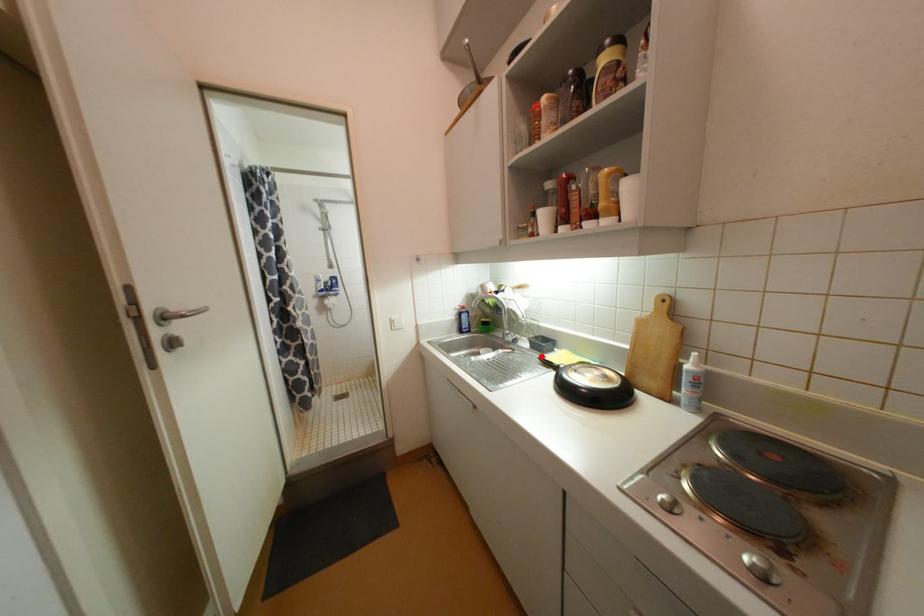
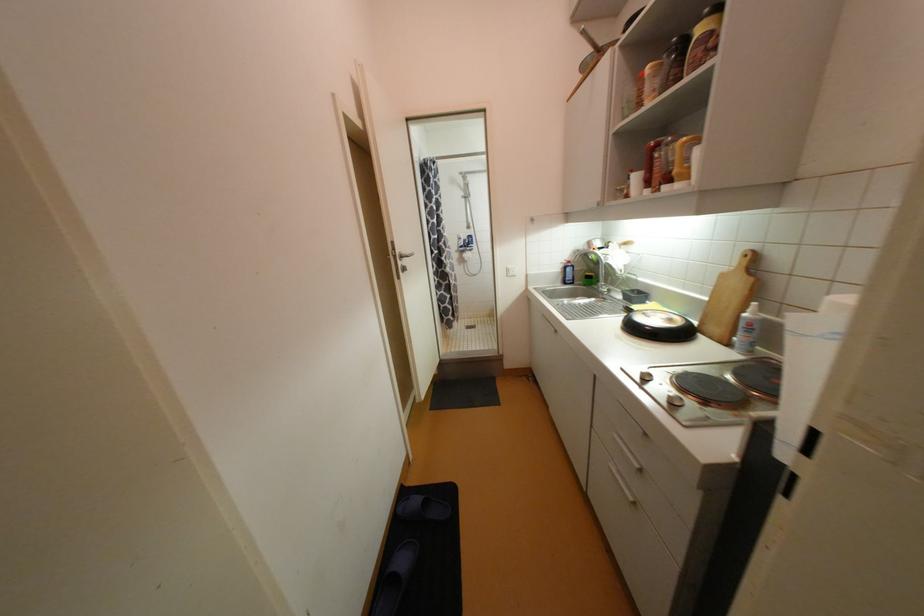
The point at the highlighted location is marked in the first image. Where is the corresponding point in the second image?

(628, 305)